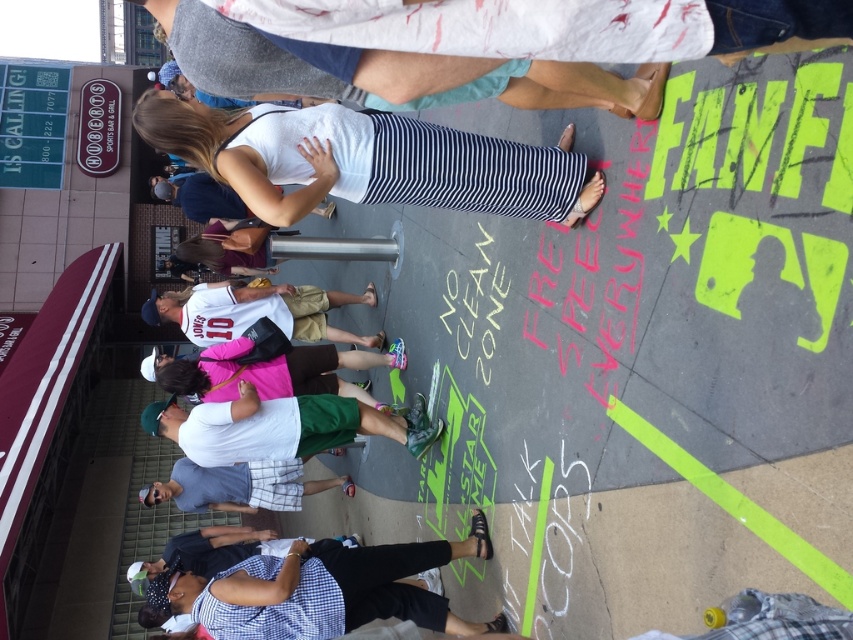
Does point (216, 428) come closer to viewer compared to point (254, 310)?

Yes, it is.

Which is behind, point (239, 408) or point (280, 317)?

Point (280, 317)

Is point (194, 413) positioned behind point (250, 300)?

No, it is not.

This screenshot has height=640, width=853. Find the location of `white matte shirt at center`. white matte shirt at center is located at coordinates (276, 426).

Who is more distant from viewer, (310, 598) or (155, 310)?

The point (155, 310) is behind.

The image size is (853, 640). What do you see at coordinates (323, 589) in the screenshot? I see `checkered fabric shirt at lower center` at bounding box center [323, 589].

The image size is (853, 640). Find the location of `checkered fabric shirt at lower center`. checkered fabric shirt at lower center is located at coordinates (323, 589).

Identify the location of checkered fabric shirt at lower center. (323, 589).

Who is positioned more to the left, white matte shirt at center or gray plaid shorts at center?

Positioned to the left is gray plaid shorts at center.

Measure the distance between white matte shirt at center and camera.

15.56 feet

Does point (415, 429) come closer to viewer compared to point (274, 481)?

Yes, it is in front of point (274, 481).

Identify the location of white matte shirt at center. The width and height of the screenshot is (853, 640). (276, 426).